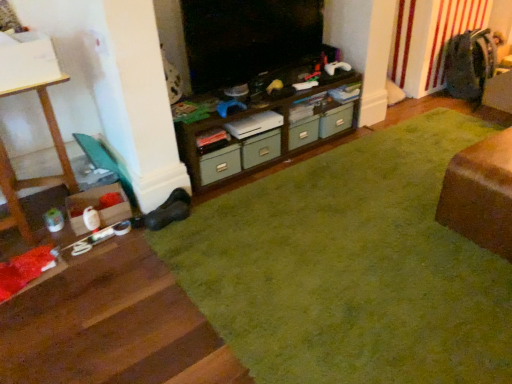
The height and width of the screenshot is (384, 512). I want to click on free location above brown wood cabinet at center (from a real-world perspective), so click(271, 90).